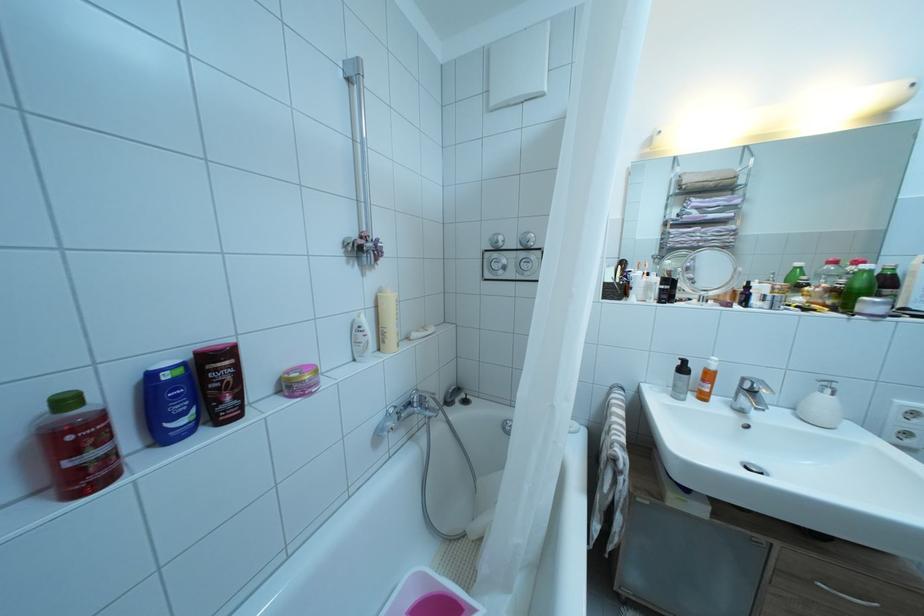
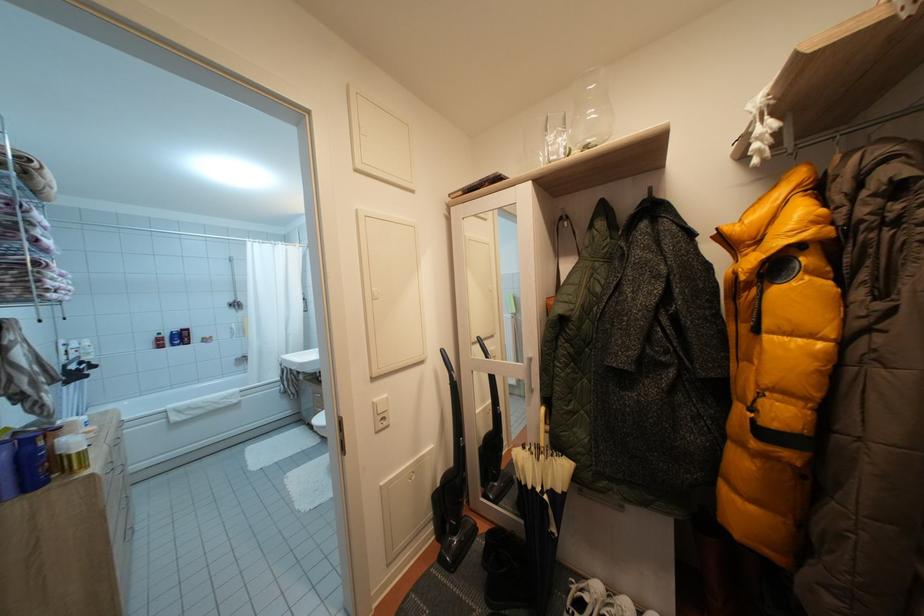
In a continuous first-person perspective shot, in which direction is the camera moving?

The cameraman moved toward right, backward.